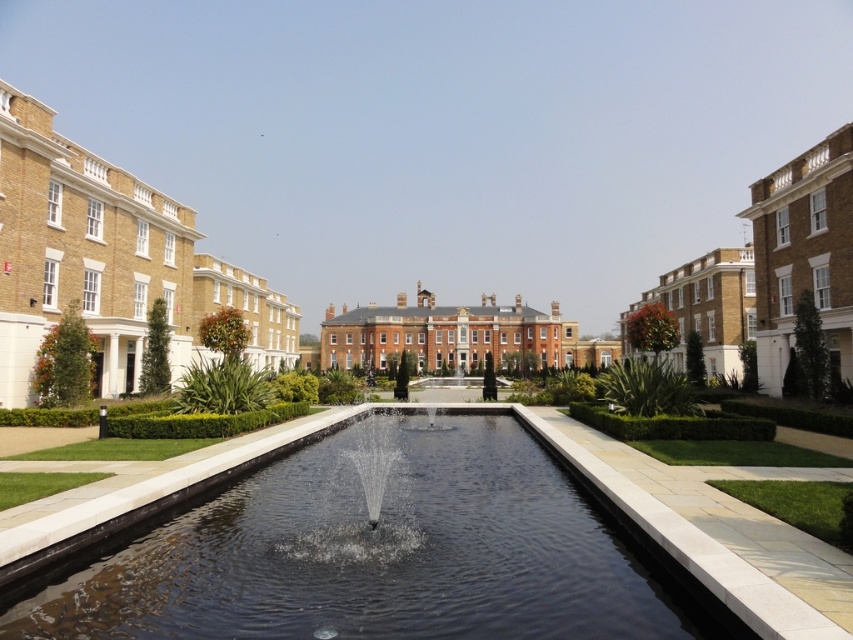
Question: Can you confirm if beige brick building at left is positioned below clear glass fountain at center?

Choices:
 (A) yes
 (B) no

Answer: (B)

Question: Which point is farther to the camera?

Choices:
 (A) matte brick building at right
 (B) brick building at center

Answer: (B)

Question: Does brown brick building at right have a lesser width compared to matte brick building at right?

Choices:
 (A) no
 (B) yes

Answer: (B)

Question: Does brick building at center have a smaller size compared to matte brick building at right?

Choices:
 (A) no
 (B) yes

Answer: (A)

Question: Which point is closer to the camera?

Choices:
 (A) (814, 195)
 (B) (680, 332)
 (C) (274, 296)
 (D) (396, 451)

Answer: (D)

Question: Among these objects, which one is farthest from the camera?

Choices:
 (A) beige brick building at left
 (B) brown brick building at right

Answer: (B)